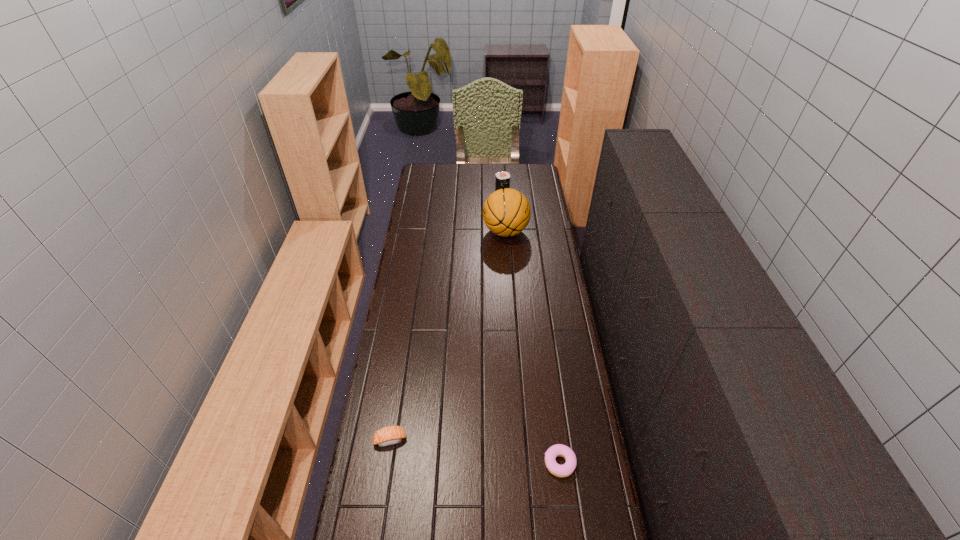
I want to click on the third closest object to the doughnut, so click(x=502, y=178).

Locate an element on the screen. This screenshot has width=960, height=540. object that ranks as the third closest to the basketball is located at coordinates (565, 470).

Find the location of `vacant space that satisfies the following two spatial constraints: 1. on the back side of the shortest object; 2. on the surface of the third nearest object near the brand logo`. vacant space that satisfies the following two spatial constraints: 1. on the back side of the shortest object; 2. on the surface of the third nearest object near the brand logo is located at coordinates (530, 232).